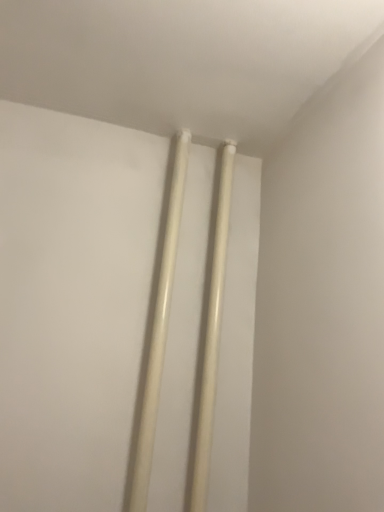
Question: In terms of height, does white glossy chopsticks at center look taller or shorter compared to white glossy curtain rod at upper center?

Choices:
 (A) short
 (B) tall

Answer: (A)

Question: From a real-world perspective, is white glossy chopsticks at center positioned above or below white glossy curtain rod at upper center?

Choices:
 (A) below
 (B) above

Answer: (A)

Question: From the image's perspective, is white glossy chopsticks at center located above or below white glossy curtain rod at upper center?

Choices:
 (A) above
 (B) below

Answer: (A)

Question: Is point (210, 311) positioned closer to the camera than point (140, 503)?

Choices:
 (A) closer
 (B) farther

Answer: (B)

Question: Based on their positions, is white glossy curtain rod at upper center located to the left or right of white glossy chopsticks at center?

Choices:
 (A) left
 (B) right

Answer: (B)

Question: Considering their positions, is white glossy curtain rod at upper center located in front of or behind white glossy chopsticks at center?

Choices:
 (A) behind
 (B) front

Answer: (A)

Question: From their relative heights in the image, would you say white glossy curtain rod at upper center is taller or shorter than white glossy chopsticks at center?

Choices:
 (A) tall
 (B) short

Answer: (A)